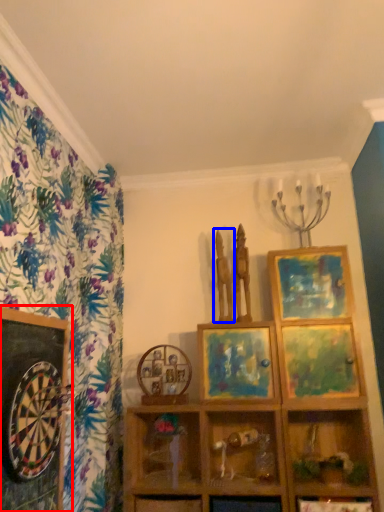
Question: Which object is closer to the camera taking this photo, picture frame (highlighted by a red box) or sculpture (highlighted by a blue box)?

Choices:
 (A) picture frame
 (B) sculpture

Answer: (A)